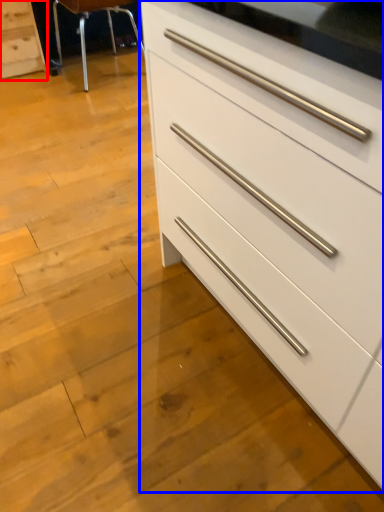
Question: Which object is further to the camera taking this photo, chest of drawers (highlighted by a red box) or chest of drawers (highlighted by a blue box)?

Choices:
 (A) chest of drawers
 (B) chest of drawers

Answer: (A)